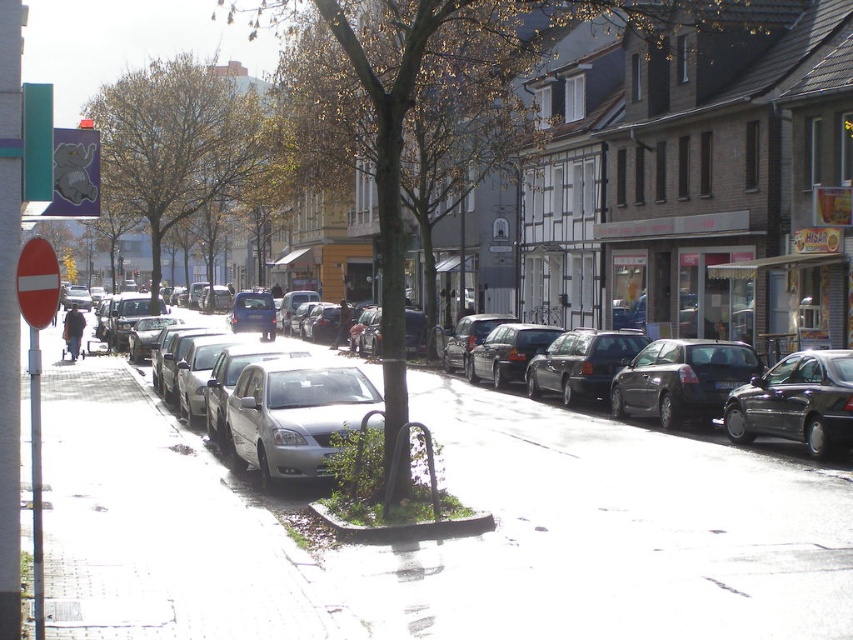
Question: Is shiny dark gray sedan at right above shiny dark blue sedan at center right?

Choices:
 (A) no
 (B) yes

Answer: (A)

Question: Observing the image, what is the correct spatial positioning of silver metallic car at center in reference to shiny dark gray sedan at right?

Choices:
 (A) left
 (B) right

Answer: (A)

Question: Is satin silver sedan at center to the left of shiny black sedan at center from the viewer's perspective?

Choices:
 (A) yes
 (B) no

Answer: (A)

Question: Among these points, which one is farthest from the camera?

Choices:
 (A) (813, 472)
 (B) (554, 369)
 (C) (248, 432)
 (D) (260, 294)

Answer: (D)

Question: Which object is closer to the camera taking this photo?

Choices:
 (A) satin silver sedan at center
 (B) shiny dark gray sedan at right
 (C) silver metallic car at center
 (D) shiny dark blue sedan at center right

Answer: (C)

Question: Estimate the real-world distances between objects in this image. Which object is farther from the satin silver sedan at center?

Choices:
 (A) shiny black sedan at center
 (B) white concrete sidewalk at center
 (C) shiny dark blue sedan at center right
 (D) silver metallic car at center

Answer: (A)